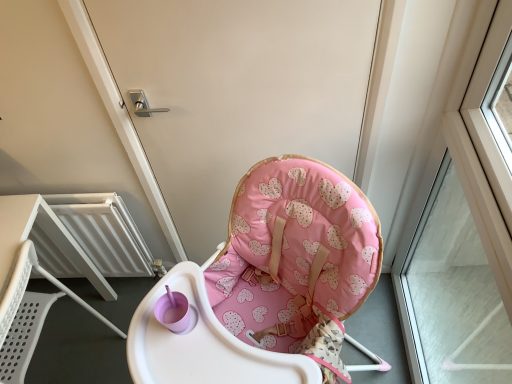
Question: Is the position of white plastic chair at lower left more distant than that of transparent glass window at right?

Choices:
 (A) yes
 (B) no

Answer: (A)

Question: Is white plastic chair at lower left turned away from transparent glass window at right?

Choices:
 (A) no
 (B) yes

Answer: (B)

Question: Are white plastic chair at lower left and transparent glass window at right far apart?

Choices:
 (A) yes
 (B) no

Answer: (A)

Question: Could transparent glass window at right be considered to be inside white plastic chair at lower left?

Choices:
 (A) no
 (B) yes

Answer: (A)

Question: Can you confirm if white plastic chair at lower left is positioned to the right of transparent glass window at right?

Choices:
 (A) yes
 (B) no

Answer: (B)

Question: Is white plastic chair at lower left outside of transparent glass window at right?

Choices:
 (A) yes
 (B) no

Answer: (A)

Question: Could you tell me if transparent glass window at right is facing white plastic chair at lower left?

Choices:
 (A) yes
 (B) no

Answer: (A)

Question: Is transparent glass window at right next to white plastic chair at lower left and touching it?

Choices:
 (A) yes
 (B) no

Answer: (B)

Question: From the image's perspective, is transparent glass window at right beneath white plastic chair at lower left?

Choices:
 (A) yes
 (B) no

Answer: (B)

Question: Is transparent glass window at right not within white plastic chair at lower left?

Choices:
 (A) no
 (B) yes

Answer: (B)

Question: Considering the relative positions of transparent glass window at right and white plastic chair at lower left in the image provided, is transparent glass window at right behind white plastic chair at lower left?

Choices:
 (A) yes
 (B) no

Answer: (B)

Question: Would you say transparent glass window at right is a long distance from white plastic chair at lower left?

Choices:
 (A) no
 (B) yes

Answer: (B)

Question: From a real-world perspective, is transparent glass window at right positioned under pink fabric highchair at center based on gravity?

Choices:
 (A) no
 (B) yes

Answer: (B)